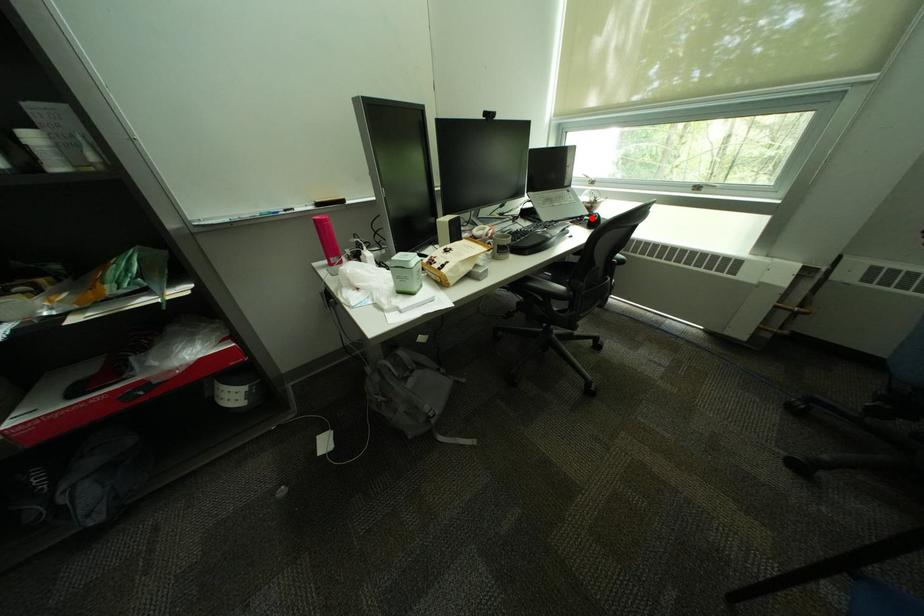
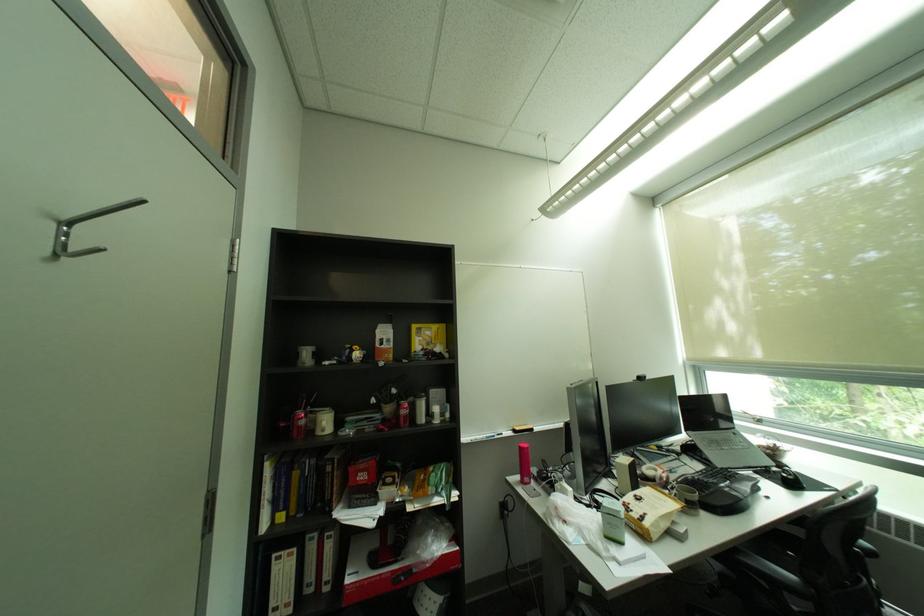
Where in the second image is the point corresponding to the highlighted location from the first image?

(777, 468)